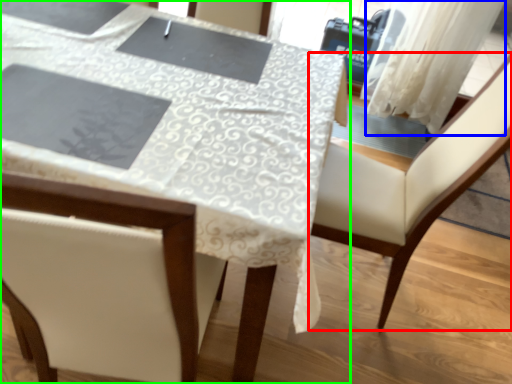
Question: Based on their relative distances, which object is farther from chair (highlighted by a red box)? Choose from curtain (highlighted by a blue box) and table (highlighted by a green box).

Choices:
 (A) curtain
 (B) table

Answer: (A)